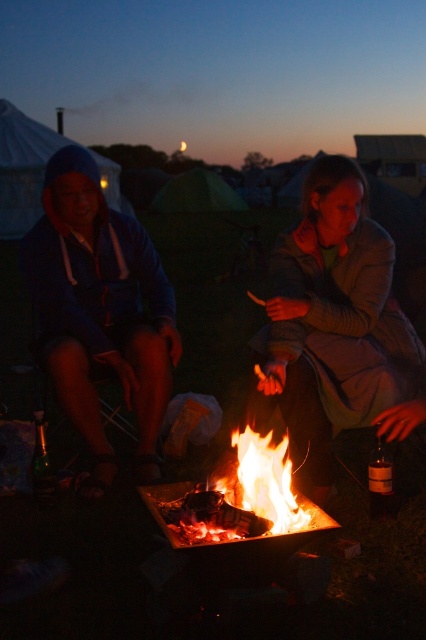
Can you confirm if matte gray jacket at center is positioned below flaming wood at center?

Actually, matte gray jacket at center is above flaming wood at center.

The width and height of the screenshot is (426, 640). Describe the element at coordinates (334, 323) in the screenshot. I see `matte gray jacket at center` at that location.

The width and height of the screenshot is (426, 640). Find the location of `matte gray jacket at center`. matte gray jacket at center is located at coordinates (334, 323).

Where is `matte gray jacket at center`? The image size is (426, 640). matte gray jacket at center is located at coordinates pyautogui.click(x=334, y=323).

Is blue fleece jacket at left positioned behind flaming wood at center?

Yes, it is.

Does blue fleece jacket at left lie in front of flaming wood at center?

That is False.

Who is more forward, (72, 198) or (242, 467)?

Point (242, 467)

Find the location of `blue fleece jacket at left`. blue fleece jacket at left is located at coordinates (100, 310).

Based on the photo, is matte gray jacket at center below blue fleece jacket at left?

Indeed, matte gray jacket at center is positioned under blue fleece jacket at left.

Is matte gray jacket at center bigger than blue fleece jacket at left?

Incorrect, matte gray jacket at center is not larger than blue fleece jacket at left.

Who is more forward, (319,440) or (158,372)?

Point (319,440)

I want to click on matte gray jacket at center, so click(x=334, y=323).